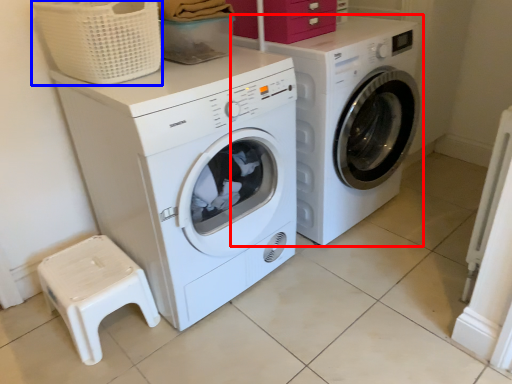
Question: Which object is further to the camera taking this photo, washing machine (highlighted by a red box) or basket (highlighted by a blue box)?

Choices:
 (A) washing machine
 (B) basket

Answer: (A)